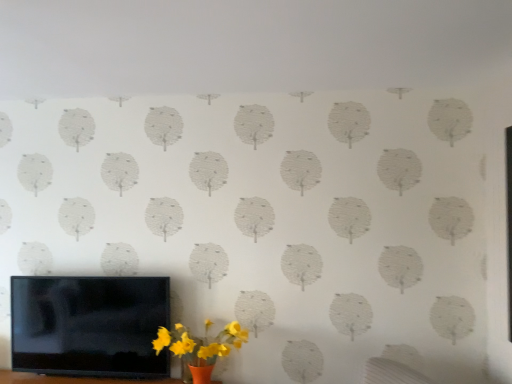
What do you see at coordinates (89, 325) in the screenshot? I see `black glossy tv at lower left` at bounding box center [89, 325].

This screenshot has height=384, width=512. I want to click on black glossy tv at lower left, so click(x=89, y=325).

Identify the location of black glossy tv at lower left. The height and width of the screenshot is (384, 512). (89, 325).